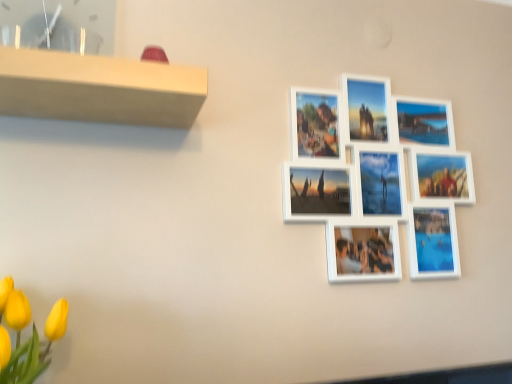
Question: Is white matte picture frame at upper right, marked as the 2th picture frame in a front-to-back arrangement, bigger than matte white picture frame at upper left, the 2th picture frame in the right-to-left sequence?

Choices:
 (A) yes
 (B) no

Answer: (A)

Question: From the image's perspective, is white matte picture frame at upper right, marked as the 2th picture frame in a front-to-back arrangement, on top of matte white picture frame at upper left, the 2th picture frame in the right-to-left sequence?

Choices:
 (A) yes
 (B) no

Answer: (B)

Question: Is white matte picture frame at upper right, positioned as the 1th picture frame in right-to-left order, beside matte white picture frame at upper left, acting as the 1th picture frame starting from the front?

Choices:
 (A) no
 (B) yes

Answer: (A)

Question: Can you confirm if white matte picture frame at upper right, positioned as the 1th picture frame in right-to-left order, is taller than matte white picture frame at upper left, placed as the second picture frame when sorted from back to front?

Choices:
 (A) yes
 (B) no

Answer: (A)

Question: From the image's perspective, is white matte picture frame at upper right, positioned as the 1th picture frame in right-to-left order, located beneath matte white picture frame at upper left, acting as the 1th picture frame starting from the front?

Choices:
 (A) no
 (B) yes

Answer: (B)

Question: Considering the relative positions of white matte picture frame at upper right, marked as the 2th picture frame in a front-to-back arrangement, and matte white picture frame at upper left, placed as the second picture frame when sorted from back to front, in the image provided, is white matte picture frame at upper right, marked as the 2th picture frame in a front-to-back arrangement, to the right of matte white picture frame at upper left, placed as the second picture frame when sorted from back to front, from the viewer's perspective?

Choices:
 (A) yes
 (B) no

Answer: (A)

Question: Is white matte picture frame at upper right, marked as the 2th picture frame in a front-to-back arrangement, at the back of matte white picture frame at upper left, acting as the 1th picture frame starting from the front?

Choices:
 (A) no
 (B) yes

Answer: (A)

Question: From the image's perspective, is matte white picture frame at upper left, the 1th picture frame from the left, below white matte picture frame at upper right, marked as the 2th picture frame in a front-to-back arrangement?

Choices:
 (A) yes
 (B) no

Answer: (B)

Question: Considering the relative sizes of matte white picture frame at upper left, the 2th picture frame in the right-to-left sequence, and white matte picture frame at upper right, marked as the second picture frame in a left-to-right arrangement, in the image provided, is matte white picture frame at upper left, the 2th picture frame in the right-to-left sequence, taller than white matte picture frame at upper right, marked as the second picture frame in a left-to-right arrangement,?

Choices:
 (A) no
 (B) yes

Answer: (A)

Question: Can you confirm if matte white picture frame at upper left, acting as the 1th picture frame starting from the front, is bigger than white matte picture frame at upper right, positioned as the 1th picture frame in right-to-left order?

Choices:
 (A) yes
 (B) no

Answer: (B)

Question: Is matte white picture frame at upper left, the 2th picture frame in the right-to-left sequence, oriented towards white matte picture frame at upper right, marked as the 2th picture frame in a front-to-back arrangement?

Choices:
 (A) no
 (B) yes

Answer: (A)

Question: Is matte white picture frame at upper left, the 1th picture frame from the left, placed right next to white matte picture frame at upper right, marked as the second picture frame in a left-to-right arrangement?

Choices:
 (A) yes
 (B) no

Answer: (B)

Question: Is white matte picture frame at upper right, positioned as the 1th picture frame in right-to-left order, inside the boundaries of matte white picture frame at upper left, the 2th picture frame in the right-to-left sequence, or outside?

Choices:
 (A) inside
 (B) outside

Answer: (B)